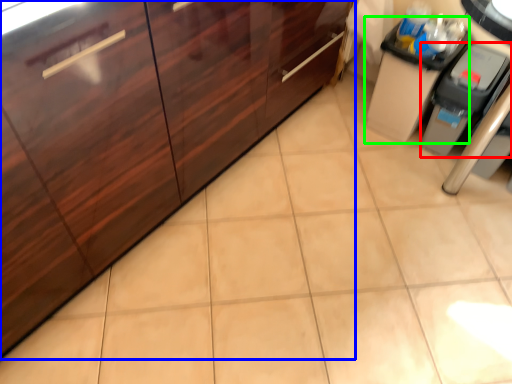
Question: Which object is positioned closest to appliance (highlighted by a red box)? Select from cabinetry (highlighted by a blue box) and cabinetry (highlighted by a green box).

Choices:
 (A) cabinetry
 (B) cabinetry

Answer: (B)